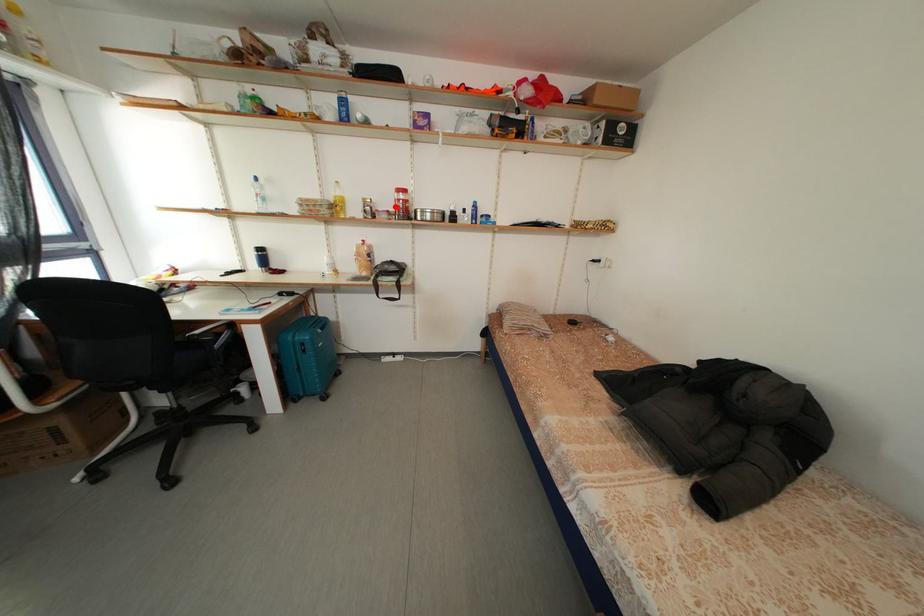
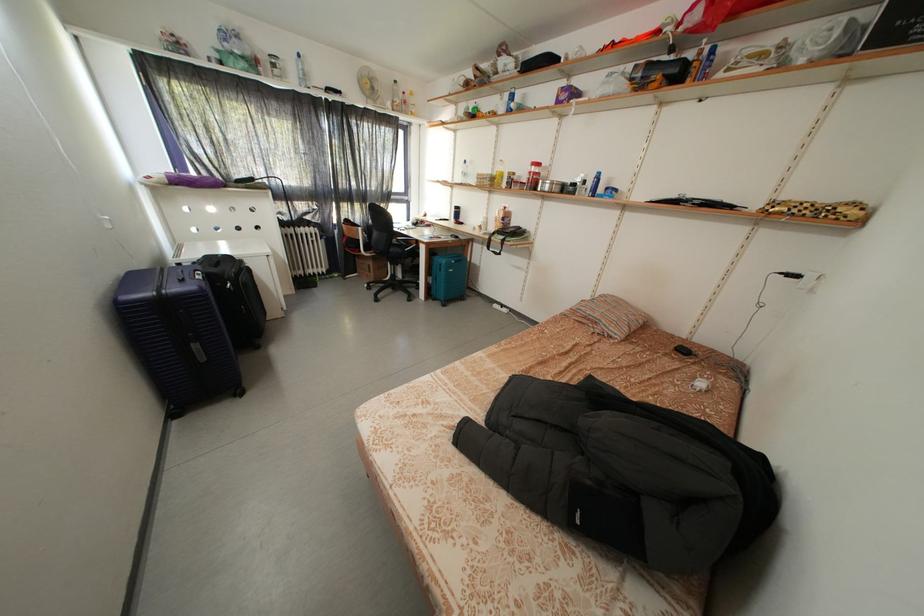
The point at the highlighted location is marked in the first image. Where is the corresponding point in the second image?

(530, 180)